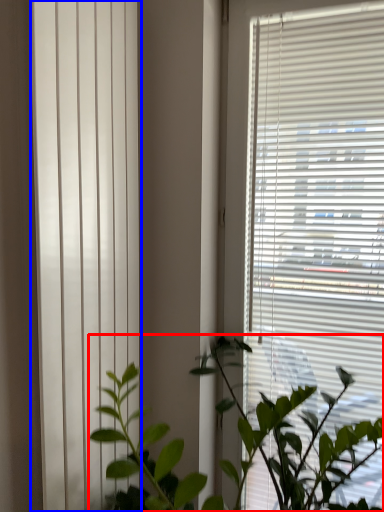
Question: Which of the following is the closest to the observer, houseplant (highlighted by a red box) or shutter (highlighted by a blue box)?

Choices:
 (A) houseplant
 (B) shutter

Answer: (A)